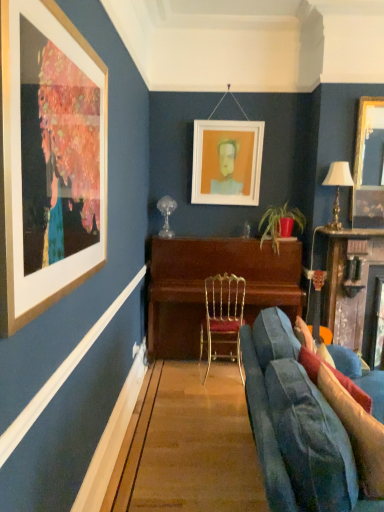
Question: Is point (355, 218) positioned closer to the camera than point (329, 445)?

Choices:
 (A) closer
 (B) farther

Answer: (B)

Question: Visually, is gold-framed mirror at upper right, the 1th picture frame positioned from the front, positioned to the left or to the right of velvet blue couch at lower right?

Choices:
 (A) right
 (B) left

Answer: (A)

Question: Which is nearer to the green leafy plant in red pot at center?

Choices:
 (A) velvet blue couch at lower right
 (B) wooden table at right
 (C) gold metallic chair at center
 (D) wooden piano at center
 (E) matte white picture frame at center, the 2th picture frame in the right-to-left sequence

Answer: (E)

Question: Which object is positioned farthest from the velvet blue couch at lower right?

Choices:
 (A) velvet blue pillow at lower right, the second pillow positioned from the back
 (B) gold metallic chair at center
 (C) wooden table at right
 (D) gold metallic table lamp at right
 (E) green leafy plant in red pot at center

Answer: (D)